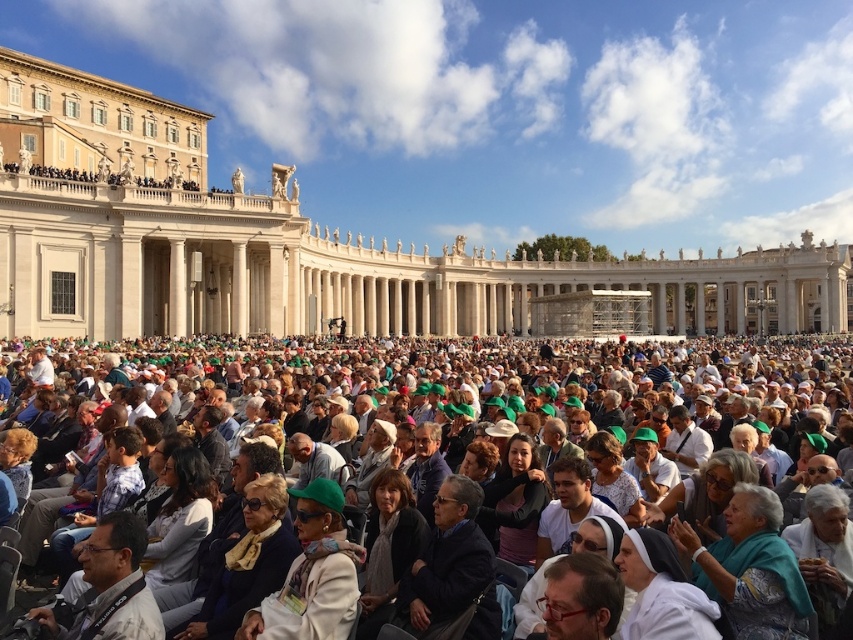
Question: Can you confirm if beige stone palace at center is bigger than green fabric crowd at center?

Choices:
 (A) yes
 (B) no

Answer: (A)

Question: Which object appears farthest from the camera in this image?

Choices:
 (A) beige stone palace at center
 (B) green fabric crowd at center

Answer: (A)

Question: Among these objects, which one is nearest to the camera?

Choices:
 (A) beige stone palace at center
 (B) green fabric crowd at center

Answer: (B)

Question: Is beige stone palace at center bigger than green fabric crowd at center?

Choices:
 (A) yes
 (B) no

Answer: (A)

Question: Observing the image, what is the correct spatial positioning of beige stone palace at center in reference to green fabric crowd at center?

Choices:
 (A) left
 (B) right

Answer: (A)